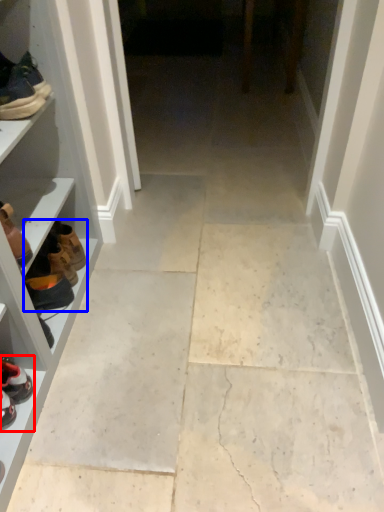
Question: Which point is further to the camera, footwear (highlighted by a red box) or shoe (highlighted by a blue box)?

Choices:
 (A) footwear
 (B) shoe

Answer: (B)